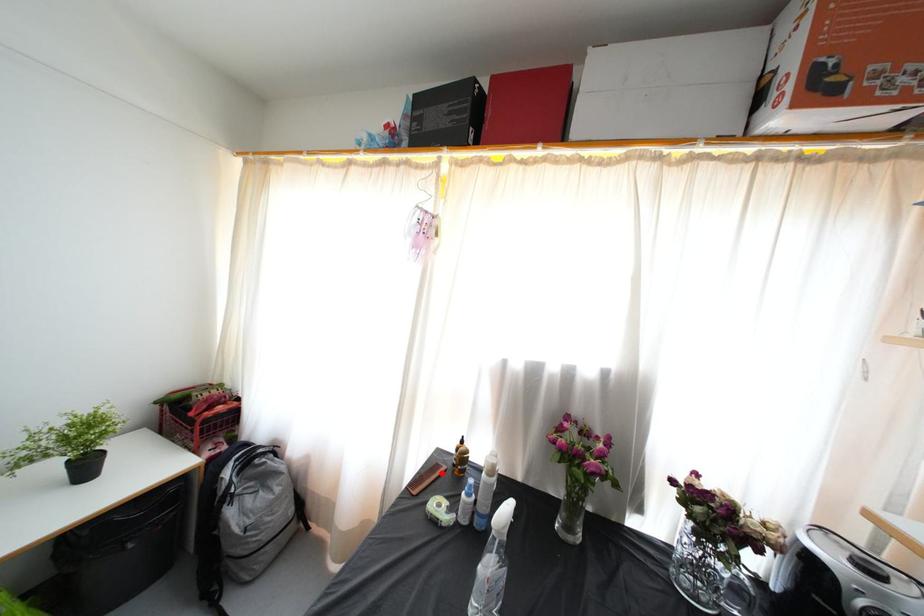
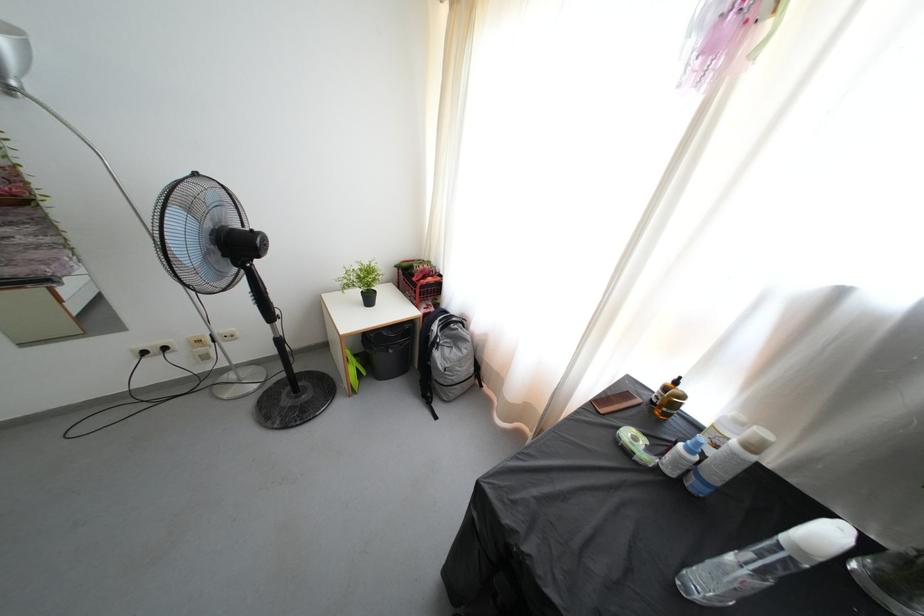
Where in the second image is the point corresponding to the highlighted location from the first image?

(633, 400)